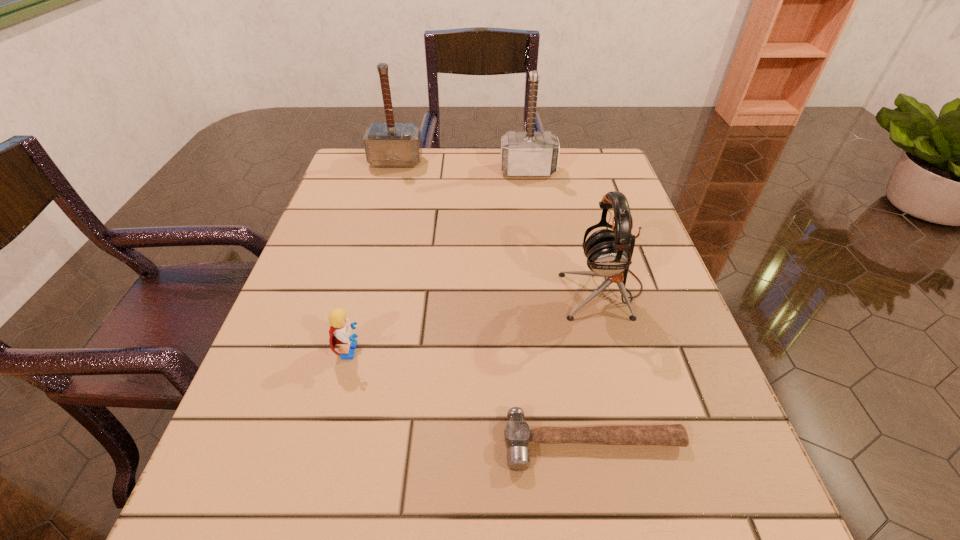
In the image, there is a desktop. At what (x,y) coordinates should I click in order to perform the action: click on free space at the far right corner. Please return your answer as a coordinate pair (x, y). Looking at the image, I should click on (588, 174).

Identify the location of vacant space at the near right corner. (734, 514).

This screenshot has width=960, height=540. I want to click on free space between the leftmost hammer and the shortest object, so click(494, 302).

Identify the location of free space between the shortest object and the earphone. The height and width of the screenshot is (540, 960). (598, 366).

Locate an element on the screen. This screenshot has height=540, width=960. vacant region between the leftmost hammer and the nearest object is located at coordinates (494, 302).

This screenshot has width=960, height=540. What are the coordinates of `unoccupied position between the earphone and the leftmost hammer` in the screenshot? It's located at (499, 225).

At what (x,y) coordinates should I click in order to perform the action: click on vacant area that lies between the Lego and the third farthest object. Please return your answer as a coordinate pair (x, y). Looking at the image, I should click on (477, 320).

Locate an element on the screen. Image resolution: width=960 pixels, height=540 pixels. free space that is in between the shortest hammer and the earphone is located at coordinates (598, 366).

Choose which object is the second nearest neighbor to the leftmost hammer. Please provide its 2D coordinates. Your answer should be formatted as a tuple, i.e. [(x, y)], where the tuple contains the x and y coordinates of a point satisfying the conditions above.

[(609, 252)]

Identify which object is located as the third nearest to the shortest hammer. Please provide its 2D coordinates. Your answer should be formatted as a tuple, i.e. [(x, y)], where the tuple contains the x and y coordinates of a point satisfying the conditions above.

[(523, 154)]